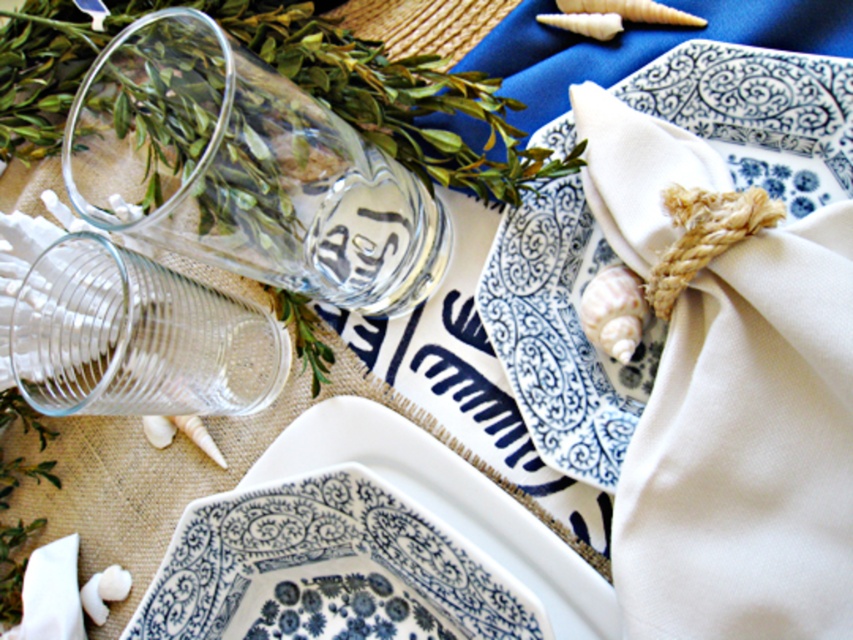
Question: Which of the following is the farthest from the observer?

Choices:
 (A) blue and white ceramic plate at upper right
 (B) blue and white ceramic platter at center

Answer: (A)

Question: Can you confirm if blue and white ceramic plate at upper right is positioned above blue and white ceramic platter at center?

Choices:
 (A) no
 (B) yes

Answer: (B)

Question: Which point is farther to the camera?

Choices:
 (A) blue and white ceramic plate at upper right
 (B) blue and white ceramic platter at center

Answer: (A)

Question: Which point appears closest to the camera in this image?

Choices:
 (A) (444, 548)
 (B) (509, 372)

Answer: (A)

Question: Is blue and white ceramic plate at upper right wider than blue and white ceramic platter at center?

Choices:
 (A) no
 (B) yes

Answer: (A)

Question: Does blue and white ceramic plate at upper right have a larger size compared to blue and white ceramic platter at center?

Choices:
 (A) no
 (B) yes

Answer: (A)